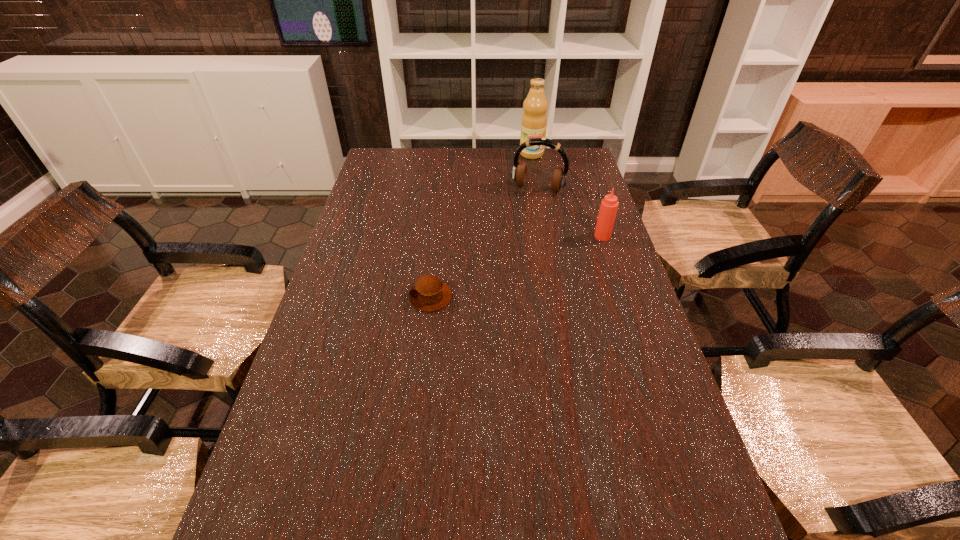
Locate an element on the screen. The width and height of the screenshot is (960, 540). muffin is located at coordinates (430, 293).

The image size is (960, 540). Find the location of `the shortest object`. the shortest object is located at coordinates (430, 293).

The image size is (960, 540). Identify the location of Tabasco sauce. (609, 205).

Where is `the rightmost object`? The image size is (960, 540). the rightmost object is located at coordinates (609, 205).

Locate an element on the screen. The image size is (960, 540). the third nearest object is located at coordinates (519, 171).

Find the location of a particular element. The height and width of the screenshot is (540, 960). olive oil is located at coordinates (534, 120).

The height and width of the screenshot is (540, 960). In order to click on the farthest object in this screenshot , I will do `click(534, 120)`.

Find the location of a particular element. vacant space located on the back of the leftmost object is located at coordinates (435, 260).

Identify the location of free location located 0.210m on the left of the Tabasco sauce. The image size is (960, 540). (531, 236).

Locate an element on the screen. This screenshot has width=960, height=540. vacant space located 0.070m on the ear cup of the headset is located at coordinates (527, 206).